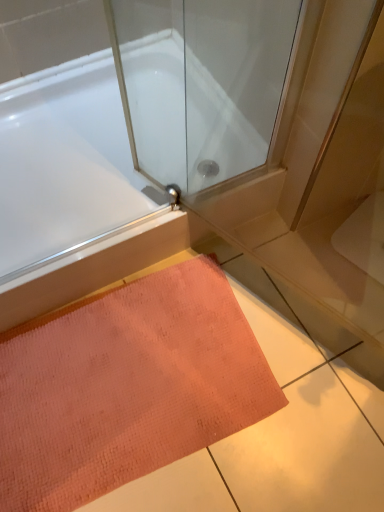
Locate an element on the screen. empty space that is ontop of orange textured mat at lower center (from a real-world perspective) is located at coordinates (123, 368).